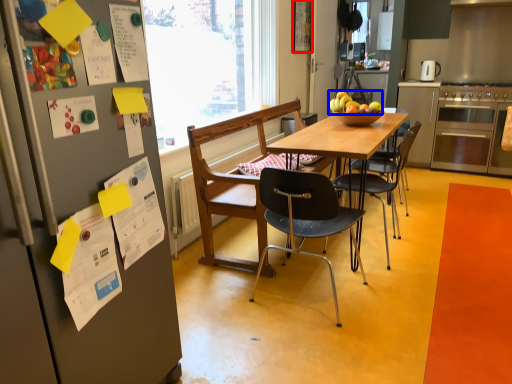
Question: Which of the following is the farthest to the observer, poster (highlighted by a red box) or fruit (highlighted by a blue box)?

Choices:
 (A) poster
 (B) fruit

Answer: (A)